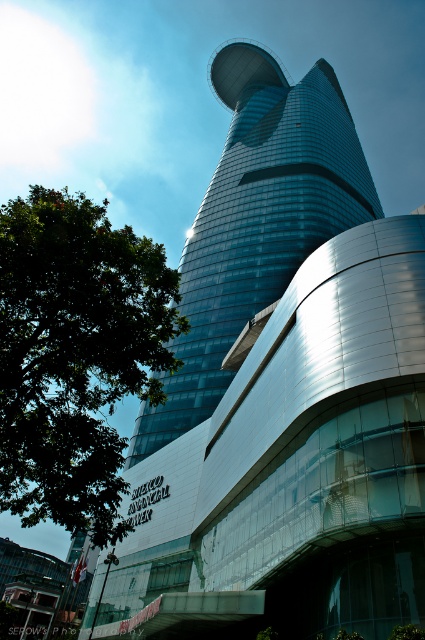
Question: Is green leafy tree at left thinner than shiny glass tower at center?

Choices:
 (A) no
 (B) yes

Answer: (A)

Question: Among these points, which one is nearest to the camera?

Choices:
 (A) (44, 445)
 (B) (212, 360)

Answer: (A)

Question: Observing the image, what is the correct spatial positioning of green leafy tree at left in reference to shiny glass tower at center?

Choices:
 (A) above
 (B) below

Answer: (B)

Question: Which point appears farthest from the camera in this image?

Choices:
 (A) (155, 288)
 (B) (144, 440)

Answer: (B)

Question: Which object is closer to the camera taking this photo?

Choices:
 (A) green leafy tree at left
 (B) shiny glass tower at center

Answer: (A)

Question: Can you confirm if green leafy tree at left is positioned above shiny glass tower at center?

Choices:
 (A) no
 (B) yes

Answer: (A)